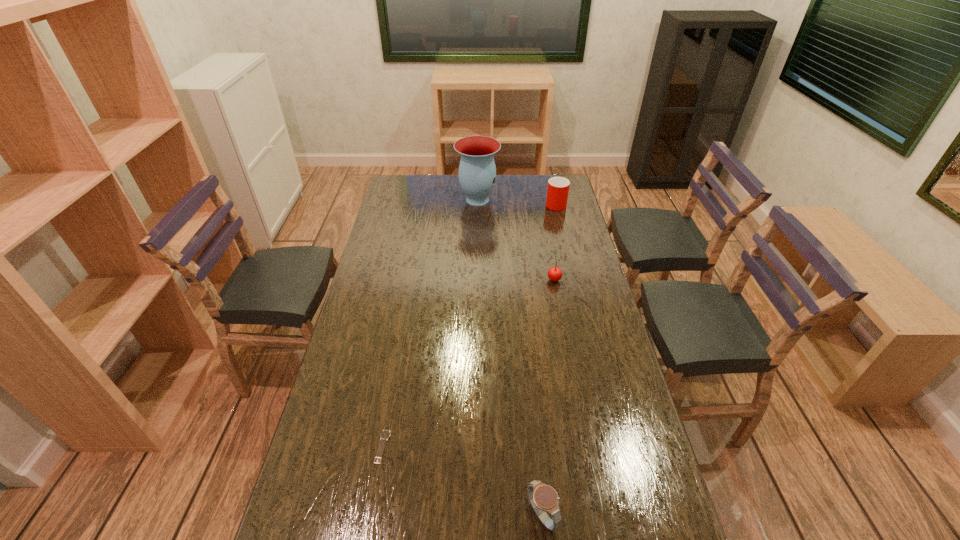
Identify the location of vacant space at the far edge. The image size is (960, 540). (526, 184).

Where is `free space at the left edge of the desktop`? Image resolution: width=960 pixels, height=540 pixels. free space at the left edge of the desktop is located at coordinates (373, 252).

This screenshot has width=960, height=540. In order to click on vacant position at the right edge of the desktop in this screenshot , I will do `click(611, 316)`.

Locate an element on the screen. vacant space at the far left corner is located at coordinates (404, 184).

The image size is (960, 540). Identify the location of vacant space at the far right corner of the desktop. (540, 186).

Where is `vacant area that lies between the cherry and the tallest object`? vacant area that lies between the cherry and the tallest object is located at coordinates (516, 239).

This screenshot has width=960, height=540. In order to click on free spot between the vase and the third farthest object in this screenshot , I will do `click(516, 239)`.

You are a GUI agent. You are given a task and a screenshot of the screen. Output one action in this format:
    pyautogui.click(x=<x>, y=<y>)
    Task: Click on the vacant point located between the left watch and the cherry
    The width and height of the screenshot is (960, 540).
    Given the screenshot: What is the action you would take?
    pyautogui.click(x=468, y=363)

At what (x,y) coordinates should I click in order to perform the action: click on vacant space in between the cup and the cherry. Please return your answer as a coordinate pair (x, y). This screenshot has height=540, width=960. Looking at the image, I should click on (555, 241).

Where is `empty space between the cherry and the third object from left to right`? Image resolution: width=960 pixels, height=540 pixels. empty space between the cherry and the third object from left to right is located at coordinates (548, 397).